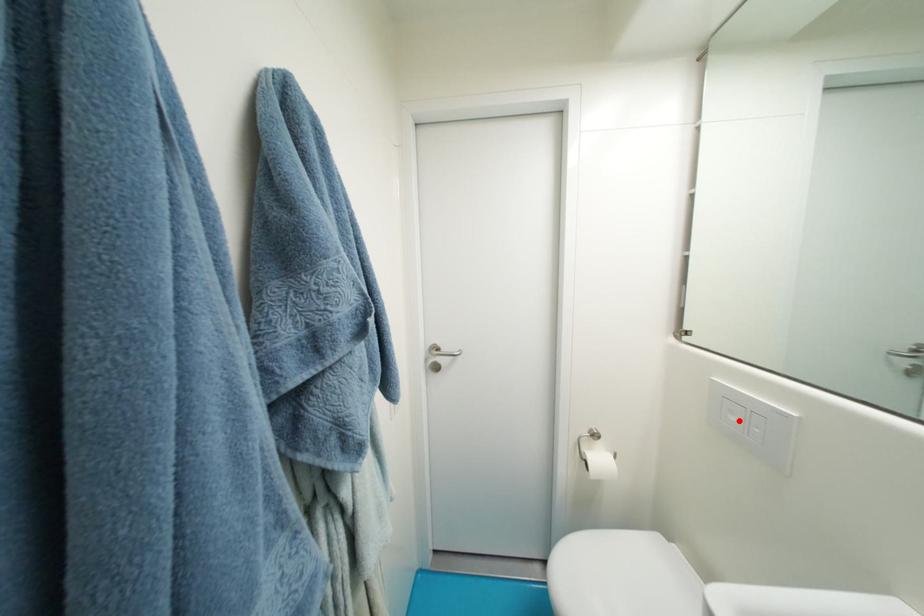
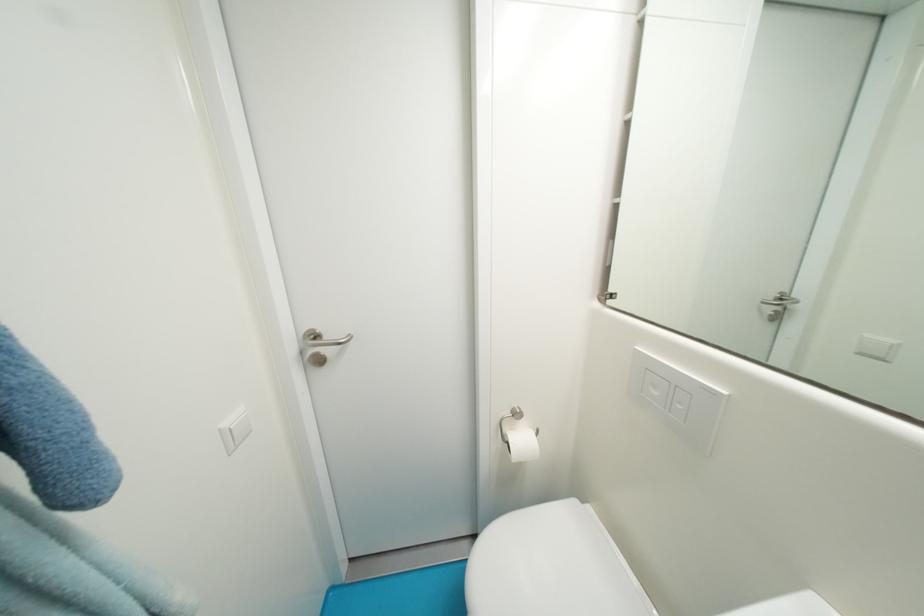
Find the pixel in the second image that matches the highlighted location in the first image.

(662, 395)